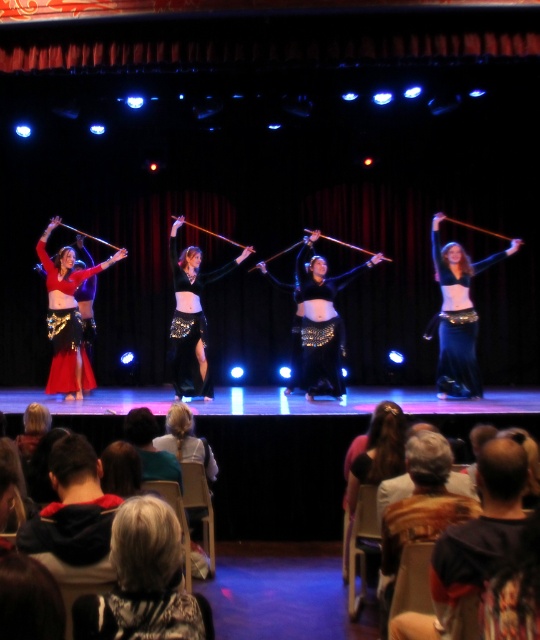
Is point (193, 259) positioned after point (375, 451)?

Yes, point (193, 259) is behind point (375, 451).

Does black sequined belly dancer at center appear under dark brown hair at lower center?

Actually, black sequined belly dancer at center is above dark brown hair at lower center.

Which is behind, point (218, 275) or point (405, 426)?

The point (218, 275) is more distant.

Where is `black sequined belly dancer at center`? This screenshot has height=640, width=540. black sequined belly dancer at center is located at coordinates (192, 317).

Is point (462, 312) positioned in front of point (178, 396)?

Yes, point (462, 312) is closer to viewer.

Does shiny black fabric at center have a greater width compared to black sequined belly dancer at center?

Correct, the width of shiny black fabric at center exceeds that of black sequined belly dancer at center.

What do you see at coordinates (459, 316) in the screenshot? The height and width of the screenshot is (640, 540). I see `shiny black fabric at center` at bounding box center [459, 316].

Where is `shiny black fabric at center`? Image resolution: width=540 pixels, height=640 pixels. shiny black fabric at center is located at coordinates (x=459, y=316).

Does dark brown leather jacket at lower right appear on the left side of dark brown hair at lower center?

Incorrect, dark brown leather jacket at lower right is not on the left side of dark brown hair at lower center.

Is dark brown leather jacket at lower right behind dark brown hair at lower center?

No, it is in front of dark brown hair at lower center.

Which is behind, point (513, 497) or point (383, 461)?

Positioned behind is point (383, 461).

Find the location of a particular element. This screenshot has width=540, height=640. dark brown leather jacket at lower right is located at coordinates tap(472, 541).